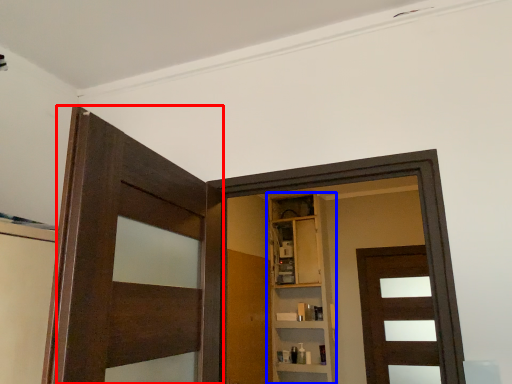
Question: Among these objects, which one is nearest to the camera, door (highlighted by a red box) or cabinetry (highlighted by a blue box)?

Choices:
 (A) door
 (B) cabinetry

Answer: (A)